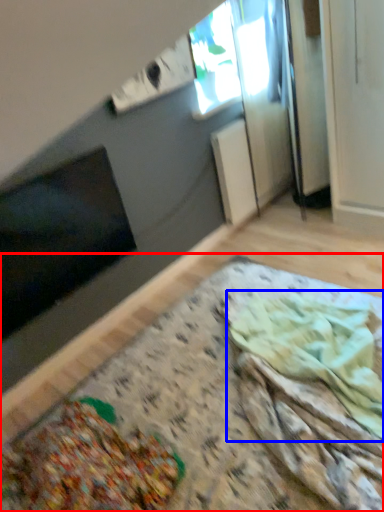
Question: Which object appears farthest to the camera in this image, table (highlighted by a red box) or food (highlighted by a blue box)?

Choices:
 (A) table
 (B) food

Answer: (B)